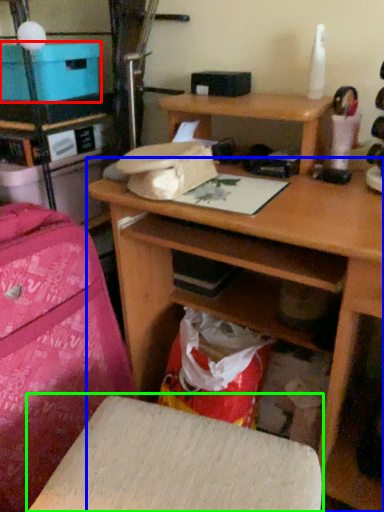
Question: Which object is the farthest from cardboard box (highlighted by a red box)? Choose among these: desk (highlighted by a blue box) or furniture (highlighted by a green box).

Choices:
 (A) desk
 (B) furniture

Answer: (B)